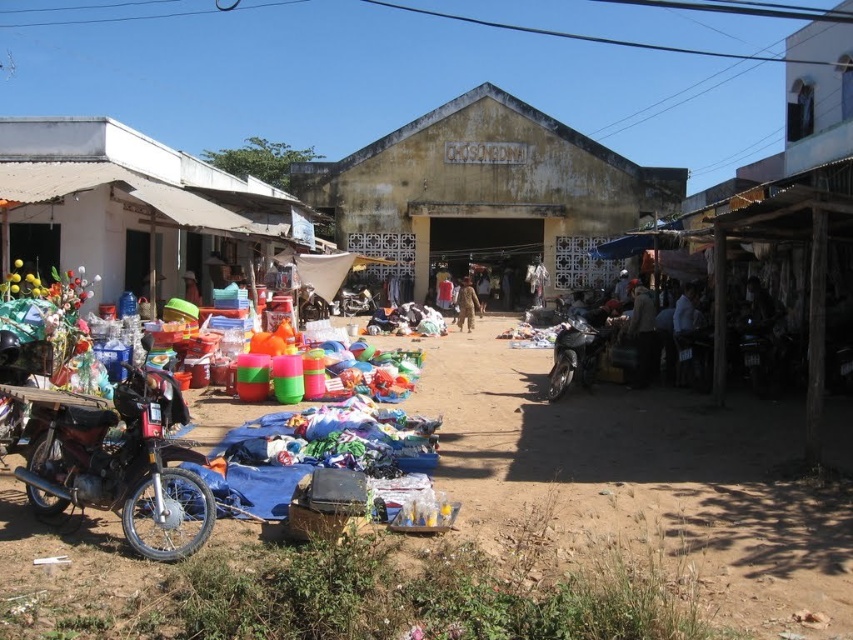
You are a delivery person carrying a large package and need to navigate through the market. You see the brown dirt field at lower left and the shiny black motorcycle at left. Can you pass between them without moving either object?

The brown dirt field at lower left and the shiny black motorcycle at left are 5.15 feet apart from each other. Since 5.15 feet is approximately 1.56 meters, which is a sufficient width for a person carrying a package to pass through, you can navigate between them without moving either object.

You are standing at the entrance of the market and see the yellowish concrete building at center and the brown fabric person at center. Which object is positioned to the right of the other?

The yellowish concrete building at center is to the right of the brown fabric person at center.

You are standing at the entrance of the market hall. You see a brown fabric jacket at center and a brown fabric person at center. Which one is closer to you?

The brown fabric jacket at center is 7.19 meters away from the brown fabric person at center. Since both are at the same center position, their distance from you at the entrance would depend on their placement along the path. However, without additional spatial details, it is impossible to determine which is closer.